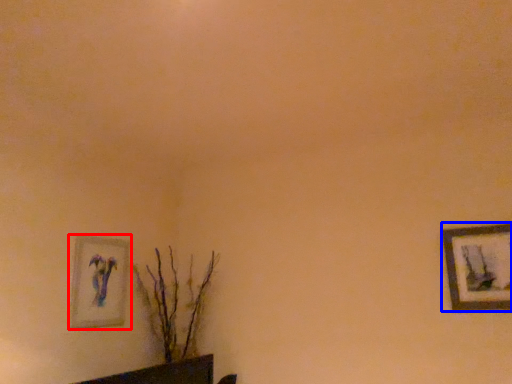
Question: Which object is further to the camera taking this photo, picture frame (highlighted by a red box) or picture frame (highlighted by a blue box)?

Choices:
 (A) picture frame
 (B) picture frame

Answer: (A)